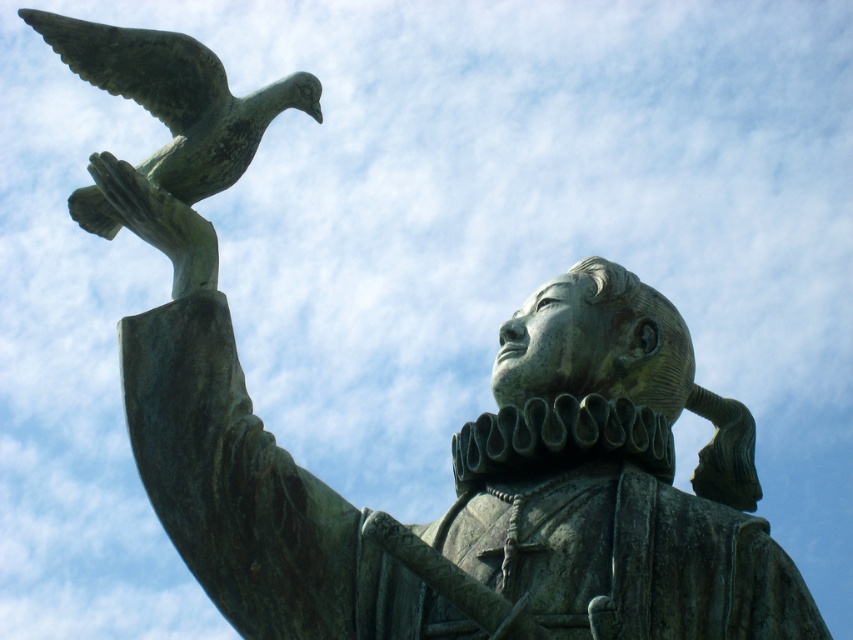
You are an art conservator examining the statue and notice the green patina bird at upper left and the bronze statue hand at upper left. Which object is taller?

The green patina bird at upper left is taller than the bronze statue hand at upper left.

You are an art conservator examining the statue. You notice the green patina bird at upper left and the bronze statue hand at upper left. Which object is positioned more to the left side of the statue?

The green patina bird at upper left is positioned more to the left side of the statue than the bronze statue hand at upper left.

You are an art student analyzing the statue. You observe the green patina bird at upper left and the bronze statue hand at upper left. Which object is positioned higher in the image?

The green patina bird at upper left is located above the bronze statue hand at upper left, so it is positioned higher in the image.